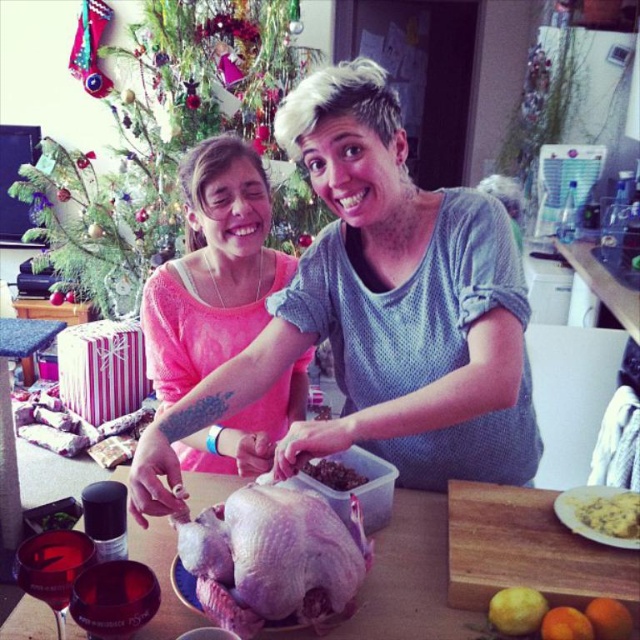
Who is more distant from viewer, (x=202, y=134) or (x=342, y=628)?

The point (x=202, y=134) is behind.

Measure the distance between point [148,122] and camera.

A distance of 3.24 meters exists between point [148,122] and camera.

Between point (144, 243) and point (163, 570), which one is positioned in front?

Point (163, 570) is in front.

Where is `matte pink sweater at upper left`? The height and width of the screenshot is (640, 640). matte pink sweater at upper left is located at coordinates (161, 138).

Does pink matte shirt at upper left appear under pale pink raw turkey at center?

No.

Between pink matte shirt at upper left and pale pink raw turkey at center, which one is positioned higher?

pink matte shirt at upper left is higher up.

Between point (360, 433) and point (298, 568), which one is positioned behind?

Positioned behind is point (360, 433).

Locate an element on the screen. pink matte shirt at upper left is located at coordinates (380, 312).

How far apart are pink matte shirt at upper left and brown crumbly mixture at center?

11.15 inches

Does point (525, 400) come closer to viewer compared to point (340, 481)?

No, it is not.

Measure the distance between point (497, 305) and camera.

Point (497, 305) and camera are 37.50 inches apart.

Where is `pink matte shirt at upper left`? This screenshot has height=640, width=640. pink matte shirt at upper left is located at coordinates (380, 312).